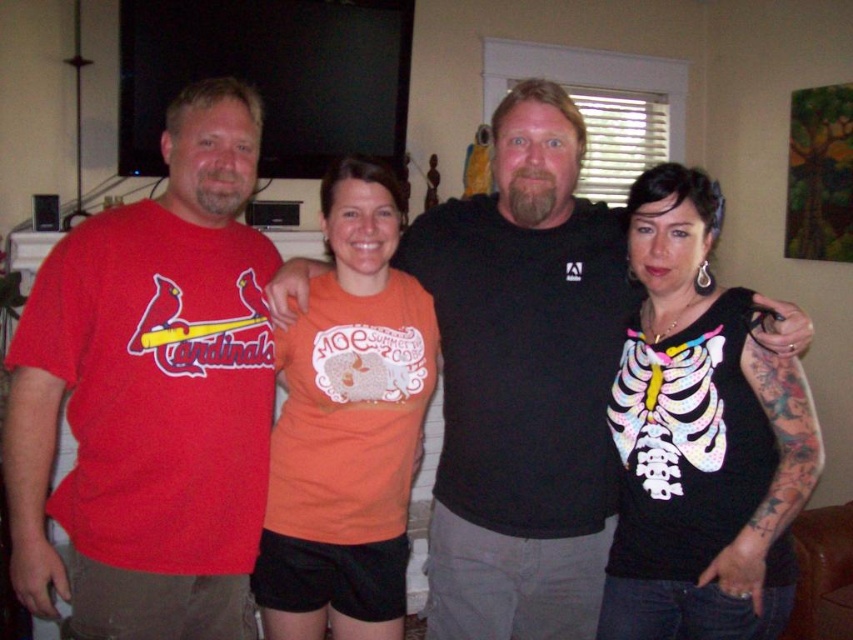
Is the position of matte red t-shirt at left less distant than that of black fabric skeleton shirt at right?

No, it is behind black fabric skeleton shirt at right.

Between matte red t-shirt at left and black fabric skeleton shirt at right, which one appears on the left side from the viewer's perspective?

matte red t-shirt at left is more to the left.

The width and height of the screenshot is (853, 640). What do you see at coordinates (151, 394) in the screenshot? I see `matte red t-shirt at left` at bounding box center [151, 394].

Where is `matte red t-shirt at left`? This screenshot has width=853, height=640. matte red t-shirt at left is located at coordinates (151, 394).

Is black matte shirt at center closer to the viewer compared to orange cotton t-shirt at center?

That is True.

Between point (438, 268) and point (395, 561), which one is positioned behind?

The point (438, 268) is behind.

Locate an element on the screen. black matte shirt at center is located at coordinates (523, 381).

Which is behind, point (572, 269) or point (729, 561)?

Point (572, 269)

Does point (544, 572) lie in front of point (784, 477)?

No, it is behind (784, 477).

Identify the location of black matte shirt at center. tap(523, 381).